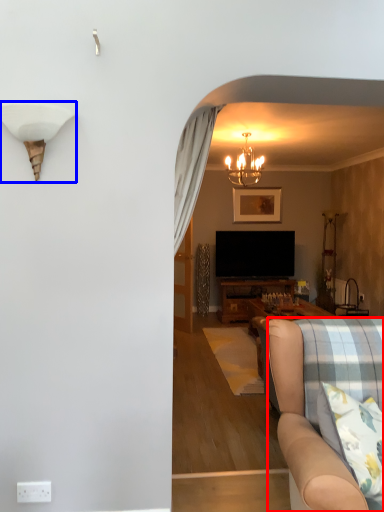
Question: Which object is closer to the camera taking this photo, studio couch (highlighted by a red box) or lamp (highlighted by a blue box)?

Choices:
 (A) studio couch
 (B) lamp

Answer: (A)